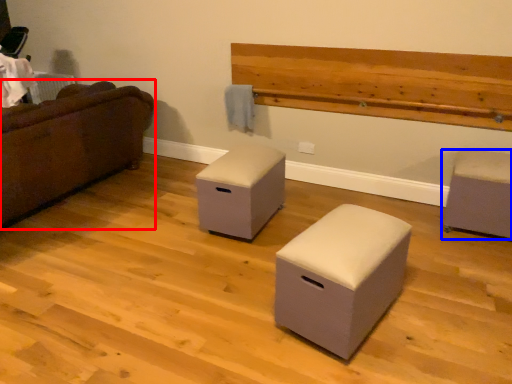
Question: Which object appears farthest to the camera in this image, studio couch (highlighted by a red box) or furniture (highlighted by a blue box)?

Choices:
 (A) studio couch
 (B) furniture

Answer: (B)